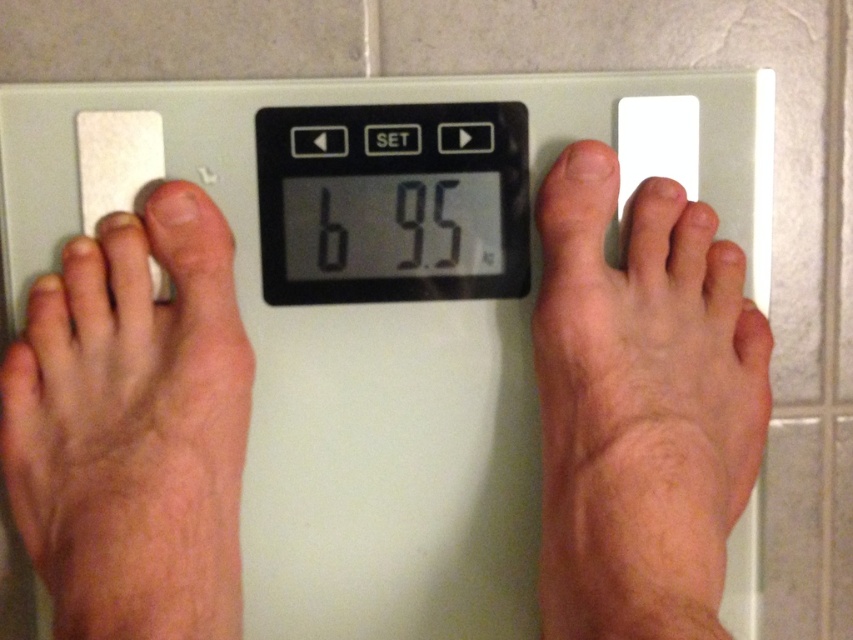
Question: Considering the real-world distances, which object is closest to the white plastic scale at center?

Choices:
 (A) pink skin at left
 (B) skinny flesh-toned foot at right
 (C) skinny bare feet at center

Answer: (C)

Question: Which object appears closest to the camera in this image?

Choices:
 (A) white plastic scale at center
 (B) pink skin at left
 (C) skinny flesh-toned foot at right
 (D) skinny bare feet at center

Answer: (C)

Question: Does pink skin at left appear on the right side of white plastic scale at center?

Choices:
 (A) yes
 (B) no

Answer: (B)

Question: Which point is closer to the camera?

Choices:
 (A) (314, 88)
 (B) (630, 477)
 (C) (190, 627)

Answer: (C)

Question: Is skinny flesh-toned foot at right in front of white plastic scale at center?

Choices:
 (A) yes
 (B) no

Answer: (A)

Question: In this image, where is pink skin at left located relative to white plastic scale at center?

Choices:
 (A) above
 (B) below

Answer: (B)